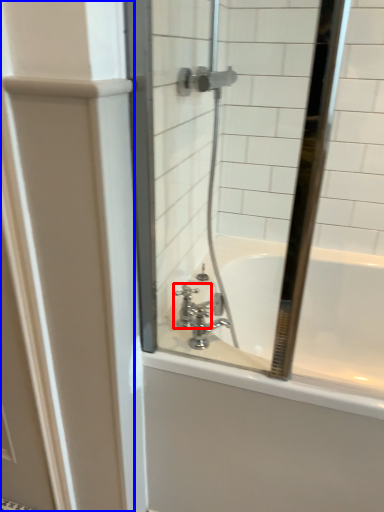
Question: Which of the following is the closest to the observer, faucet (highlighted by a red box) or screen door (highlighted by a blue box)?

Choices:
 (A) faucet
 (B) screen door

Answer: (B)